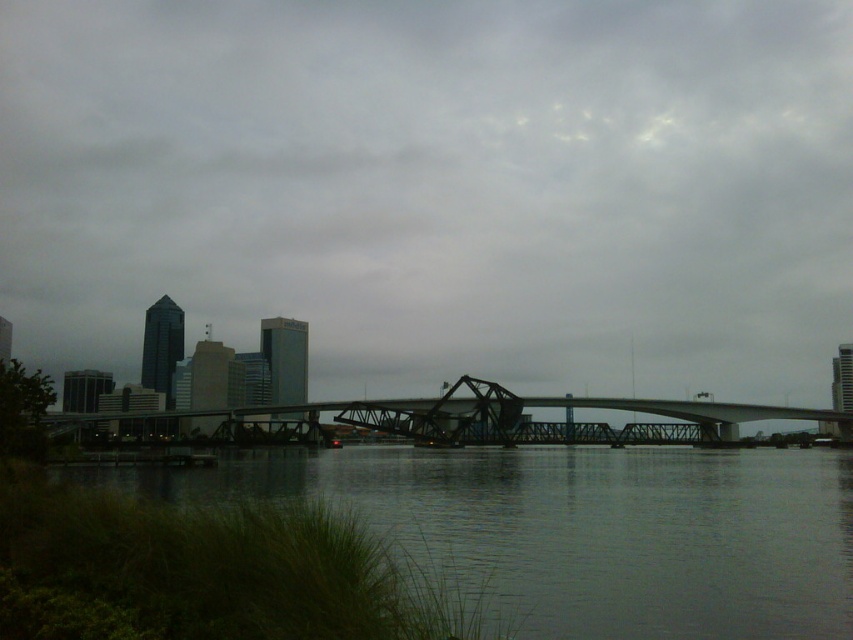
You are a boat operator who needs to navigate a vessel that is 50 meters long through the narrow channel between the dark water at lower left and the steel bridge at center. Can your boat fit through the channel without any adjustments?

The distance between the dark water at lower left and the steel bridge at center is 49.31 meters. Since the boat is 50 meters long, it cannot fit through the channel without adjustments as it is slightly longer than the available space.

You are a delivery drone with a maximum flight range of 250 meters. You need to fly from the dark water at lower left to the matte gray bridge at center. Can you reach it without needing a recharge?

The matte gray bridge at center is 250.55 meters away from dark water at lower left. Since the distance is slightly over your maximum flight range of 250 meters, you cannot reach it without needing a recharge.